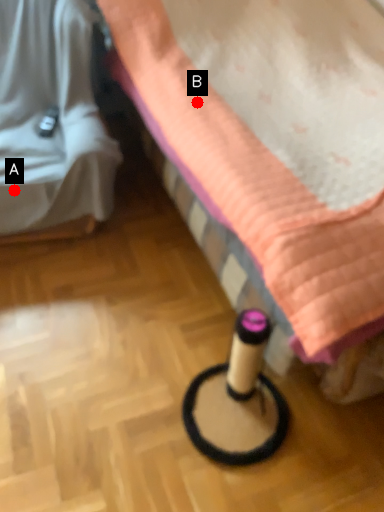
Question: Two points are circled on the image, labeled by A and B beside each circle. Which point appears farthest from the camera in this image?

Choices:
 (A) A is further
 (B) B is further

Answer: (A)